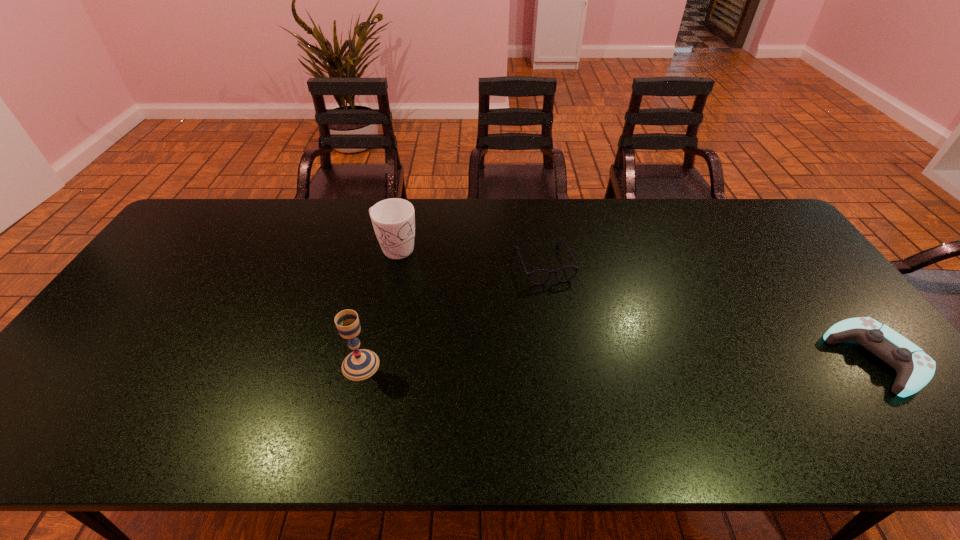
Identify the location of vacant space that is in between the spectacles and the chalice. The image size is (960, 540). (452, 314).

You are a GUI agent. You are given a task and a screenshot of the screen. Output one action in this format:
    pyautogui.click(x=<x>, y=<y>)
    Task: Click on the object that is the third closest to the mug
    This screenshot has height=540, width=960.
    Given the screenshot: What is the action you would take?
    pyautogui.click(x=915, y=368)

Choose which object is the second nearest neighbor to the spectacles. Please provide its 2D coordinates. Your answer should be formatted as a tuple, i.e. [(x, y)], where the tuple contains the x and y coordinates of a point satisfying the conditions above.

[(361, 364)]

This screenshot has width=960, height=540. In order to click on vacant space that satisfies the following two spatial constraints: 1. on the front side of the mug; 2. on the left side of the control in this screenshot , I will do `click(372, 359)`.

The height and width of the screenshot is (540, 960). I want to click on blank space that satisfies the following two spatial constraints: 1. on the back side of the chalice; 2. on the left side of the spectacles, so click(x=384, y=264).